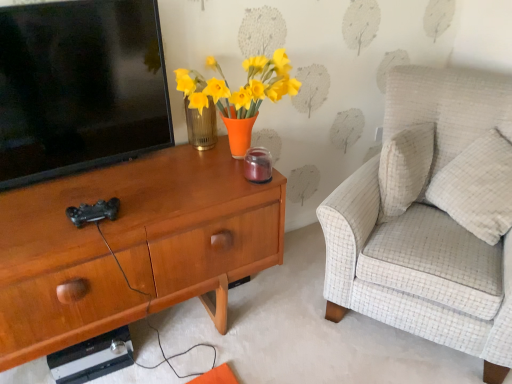
Question: Can you confirm if light beige fabric armchair at right is smaller than woodendesk at left?

Choices:
 (A) yes
 (B) no

Answer: (B)

Question: Does light beige fabric armchair at right lie behind woodendesk at left?

Choices:
 (A) no
 (B) yes

Answer: (B)

Question: Is light beige fabric armchair at right aimed at woodendesk at left?

Choices:
 (A) no
 (B) yes

Answer: (A)

Question: From the image's perspective, is light beige fabric armchair at right under woodendesk at left?

Choices:
 (A) no
 (B) yes

Answer: (A)

Question: Is light beige fabric armchair at right bigger than woodendesk at left?

Choices:
 (A) yes
 (B) no

Answer: (A)

Question: From the image's perspective, is black glossy television at left above or below light beige fabric armchair at right?

Choices:
 (A) below
 (B) above

Answer: (B)

Question: In terms of height, does black glossy television at left look taller or shorter compared to light beige fabric armchair at right?

Choices:
 (A) short
 (B) tall

Answer: (A)

Question: From a real-world perspective, is black glossy television at left positioned above or below light beige fabric armchair at right?

Choices:
 (A) below
 (B) above

Answer: (B)

Question: Considering the positions of black glossy television at left and light beige fabric armchair at right in the image, is black glossy television at left wider or thinner than light beige fabric armchair at right?

Choices:
 (A) wide
 (B) thin

Answer: (B)

Question: From the image's perspective, is woodendesk at left located above or below light beige fabric armchair at right?

Choices:
 (A) below
 (B) above

Answer: (A)

Question: In terms of height, does woodendesk at left look taller or shorter compared to light beige fabric armchair at right?

Choices:
 (A) short
 (B) tall

Answer: (A)

Question: Looking at their shapes, would you say woodendesk at left is wider or thinner than light beige fabric armchair at right?

Choices:
 (A) thin
 (B) wide

Answer: (A)

Question: Is point (98, 254) closer or farther from the camera than point (500, 345)?

Choices:
 (A) farther
 (B) closer

Answer: (B)

Question: Is white textured pillow at right taller or shorter than light beige fabric armchair at right?

Choices:
 (A) tall
 (B) short

Answer: (B)

Question: Is white textured pillow at right to the left or to the right of light beige fabric armchair at right in the image?

Choices:
 (A) left
 (B) right

Answer: (B)